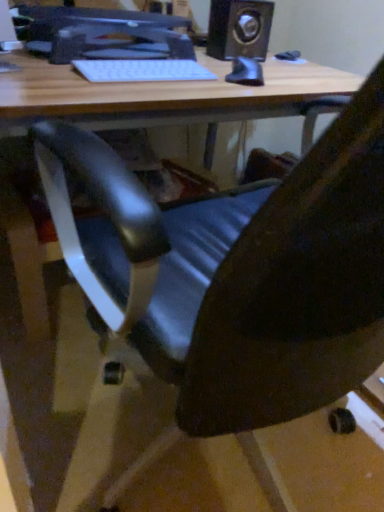
Question: Is black plastic speaker at upper right completely or partially inside matte black monitor at upper center?

Choices:
 (A) no
 (B) yes

Answer: (A)

Question: Considering the relative sizes of matte black monitor at upper center and black plastic speaker at upper right in the image provided, is matte black monitor at upper center thinner than black plastic speaker at upper right?

Choices:
 (A) yes
 (B) no

Answer: (B)

Question: From the image's perspective, is matte black monitor at upper center above black plastic speaker at upper right?

Choices:
 (A) no
 (B) yes

Answer: (A)

Question: Does matte black monitor at upper center have a larger size compared to black plastic speaker at upper right?

Choices:
 (A) yes
 (B) no

Answer: (A)

Question: Is matte black monitor at upper center closer to camera compared to black plastic speaker at upper right?

Choices:
 (A) no
 (B) yes

Answer: (B)

Question: Considering their positions, is white matte keyboard at upper center located in front of or behind black plastic speaker at upper right?

Choices:
 (A) front
 (B) behind

Answer: (A)

Question: Considering the positions of white matte keyboard at upper center and black plastic speaker at upper right in the image, is white matte keyboard at upper center wider or thinner than black plastic speaker at upper right?

Choices:
 (A) wide
 (B) thin

Answer: (B)

Question: From a real-world perspective, is white matte keyboard at upper center positioned above or below black plastic speaker at upper right?

Choices:
 (A) below
 (B) above

Answer: (A)

Question: In terms of height, does white matte keyboard at upper center look taller or shorter compared to black plastic speaker at upper right?

Choices:
 (A) tall
 (B) short

Answer: (B)

Question: In the image, is black plastic speaker at upper right positioned in front of or behind matte black monitor at upper center?

Choices:
 (A) front
 (B) behind

Answer: (B)

Question: Is point (264, 52) positioned closer to the camera than point (99, 19)?

Choices:
 (A) farther
 (B) closer

Answer: (A)

Question: In terms of height, does black plastic speaker at upper right look taller or shorter compared to matte black monitor at upper center?

Choices:
 (A) tall
 (B) short

Answer: (A)

Question: From the image's perspective, is black plastic speaker at upper right above or below matte black monitor at upper center?

Choices:
 (A) below
 (B) above

Answer: (B)

Question: From the image's perspective, is matte black monitor at upper center positioned above or below white matte keyboard at upper center?

Choices:
 (A) below
 (B) above

Answer: (B)

Question: From a real-world perspective, relative to white matte keyboard at upper center, is matte black monitor at upper center vertically above or below?

Choices:
 (A) above
 (B) below

Answer: (A)